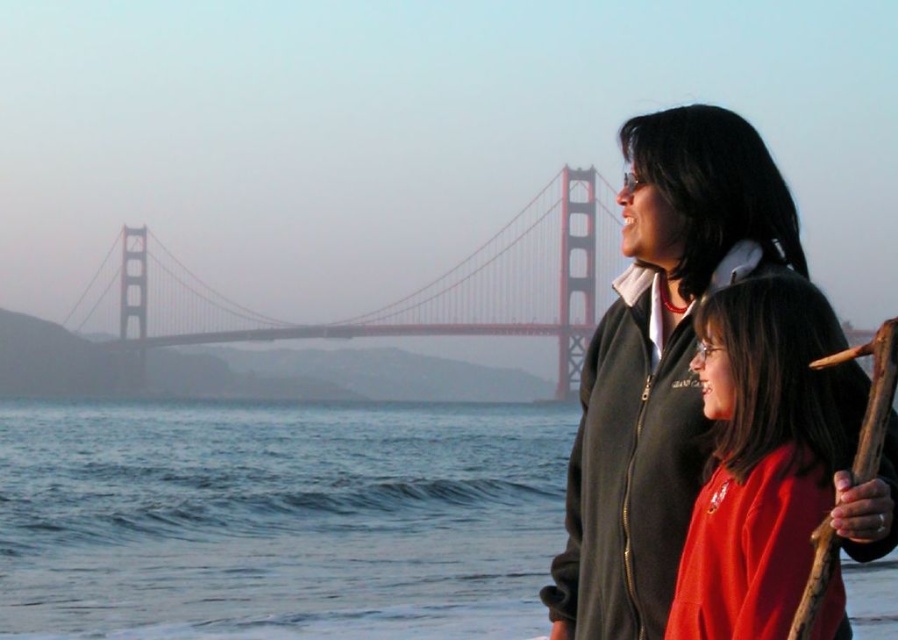
Question: Is dark gray fleece jacket at right above red painted steel bridge at center?

Choices:
 (A) no
 (B) yes

Answer: (A)

Question: Based on their relative distances, which object is nearer to the red painted steel bridge at center?

Choices:
 (A) blue water at lower left
 (B) dark gray fleece jacket at right

Answer: (A)

Question: Which is farther from the red painted steel bridge at center?

Choices:
 (A) dark gray fleece jacket at right
 (B) blue water at lower left
 (C) matte red sweater at center

Answer: (C)

Question: Is blue water at lower left wider than red painted steel bridge at center?

Choices:
 (A) yes
 (B) no

Answer: (B)

Question: Which object is positioned closest to the blue water at lower left?

Choices:
 (A) red painted steel bridge at center
 (B) dark gray fleece jacket at right
 (C) matte red sweater at center

Answer: (C)

Question: Does blue water at lower left appear under matte red sweater at center?

Choices:
 (A) no
 (B) yes

Answer: (B)